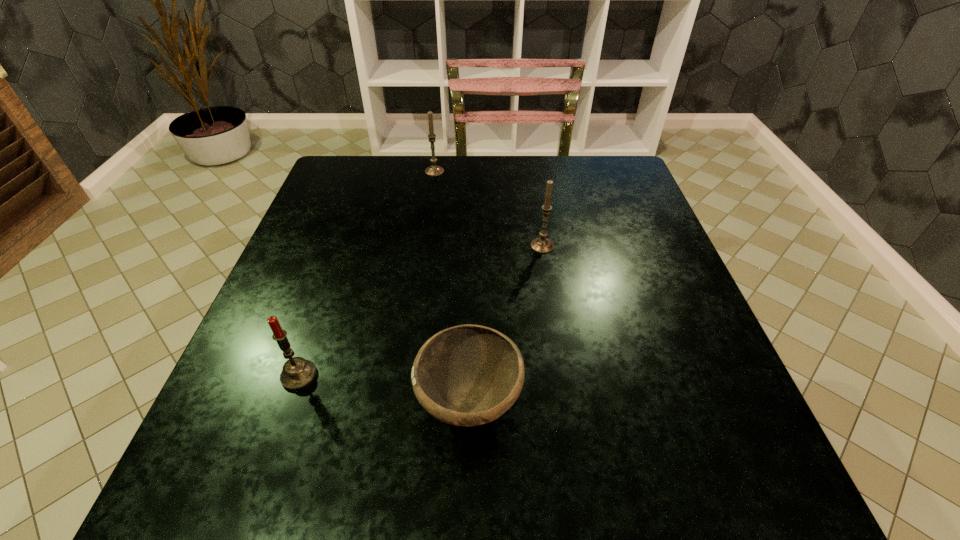
Find the location of a particular element. vacant region at the near right corner is located at coordinates (738, 472).

Find the location of a particular element. Image resolution: width=960 pixels, height=540 pixels. free space between the leftmost candle and the bowl is located at coordinates (384, 389).

This screenshot has height=540, width=960. Find the location of `free space between the shortest object and the farthest object`. free space between the shortest object and the farthest object is located at coordinates (452, 287).

At what (x,y) coordinates should I click in order to perform the action: click on free space between the second candle from left to right and the leftmost candle. Please return your answer as a coordinate pair (x, y). The height and width of the screenshot is (540, 960). Looking at the image, I should click on (367, 274).

Locate an element on the screen. The width and height of the screenshot is (960, 540). vacant point located between the nearest candle and the second nearest candle is located at coordinates (420, 311).

Locate an element on the screen. The height and width of the screenshot is (540, 960). empty location between the rightmost candle and the farthest candle is located at coordinates (489, 209).

What are the coordinates of `free space between the third nearest object and the nearest candle` in the screenshot? It's located at (420, 311).

Identify the location of empty space between the leftmost candle and the bowl. This screenshot has width=960, height=540. (384, 389).

The image size is (960, 540). What are the coordinates of `free space between the rightmost object and the shortest object` in the screenshot? It's located at (506, 324).

In order to click on empty space between the farthest object and the rightmost object in this screenshot , I will do `click(489, 209)`.